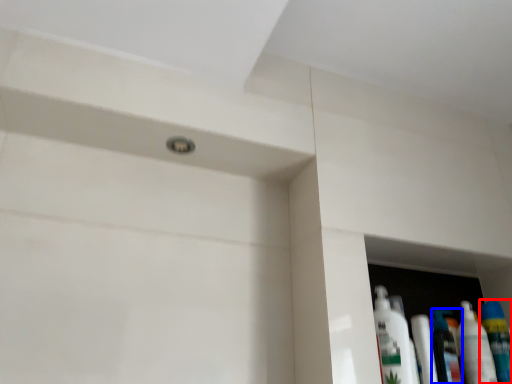
Question: Which of the following is the farthest to the observer, mouthwash (highlighted by a red box) or mouthwash (highlighted by a blue box)?

Choices:
 (A) mouthwash
 (B) mouthwash

Answer: (B)